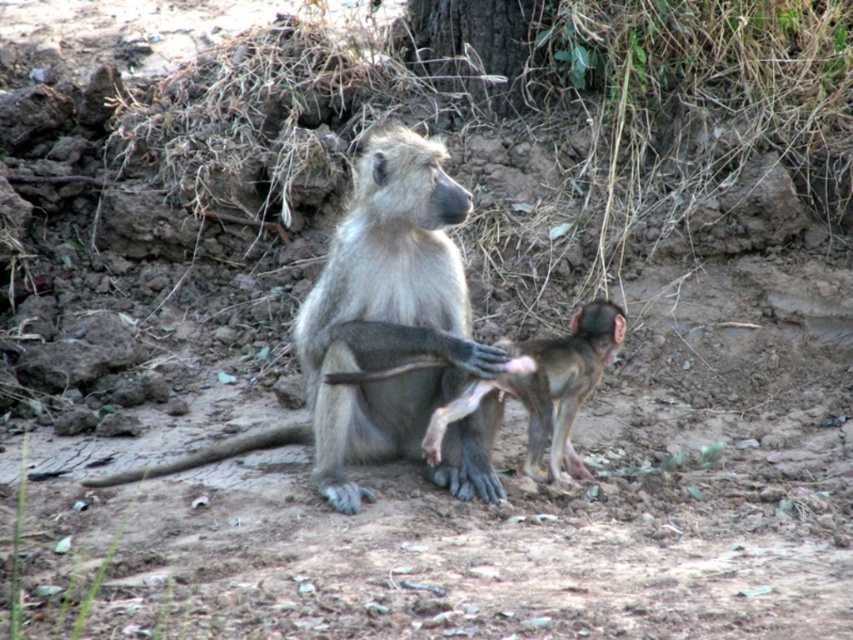
Does gray fur monkey at center appear over smooth brown monkey at center?

Yes, gray fur monkey at center is above smooth brown monkey at center.

Can you confirm if gray fur monkey at center is wider than smooth brown monkey at center?

Indeed, gray fur monkey at center has a greater width compared to smooth brown monkey at center.

What do you see at coordinates (374, 321) in the screenshot? I see `gray fur monkey at center` at bounding box center [374, 321].

Where is `gray fur monkey at center`? The height and width of the screenshot is (640, 853). gray fur monkey at center is located at coordinates (374, 321).